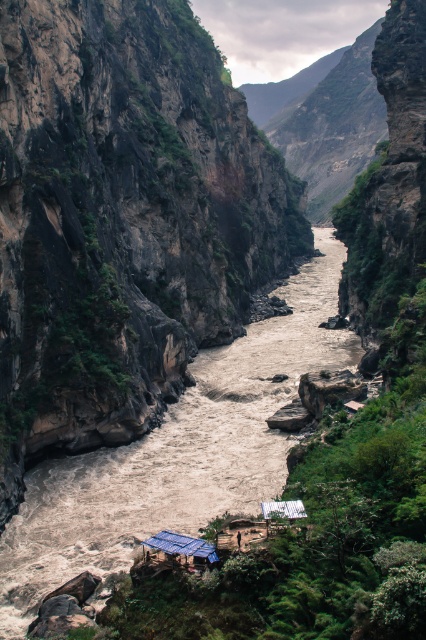
Question: Among these points, which one is nearest to the camera?

Choices:
 (A) (167, 545)
 (B) (189, 476)
 (C) (284, 515)

Answer: (C)

Question: Can you confirm if blue corrugated metal hut at center is wider than white corrugated metal hut at center?

Choices:
 (A) yes
 (B) no

Answer: (A)

Question: Which of the following is the farthest from the observer?

Choices:
 (A) blue corrugated metal hut at center
 (B) brown muddy water at center
 (C) white corrugated metal hut at center

Answer: (B)

Question: Is brown muddy water at center positioned behind white corrugated metal hut at center?

Choices:
 (A) no
 (B) yes

Answer: (B)

Question: Which point is farther to the camera?

Choices:
 (A) (190, 538)
 (B) (181, 465)
 (C) (270, 529)

Answer: (B)

Question: Does brown muddy water at center have a greater width compared to white corrugated metal hut at center?

Choices:
 (A) no
 (B) yes

Answer: (B)